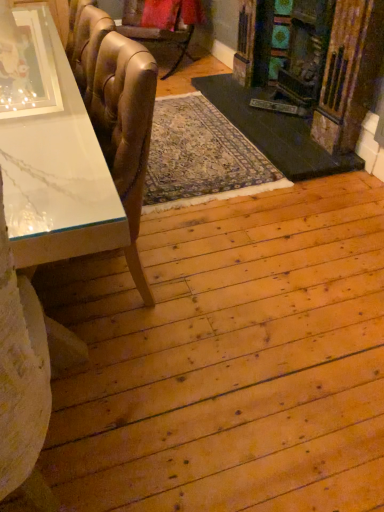
Question: Is leather-like gold chair at upper left, acting as the second chair starting from the front, smaller than white marble table at left?

Choices:
 (A) yes
 (B) no

Answer: (A)

Question: Is leather-like gold chair at upper left, which ranks as the second chair in bottom-to-top order, facing towards white marble table at left?

Choices:
 (A) yes
 (B) no

Answer: (A)

Question: Is white marble table at left a part of leather-like gold chair at upper left, marked as the first chair in a top-to-bottom arrangement?

Choices:
 (A) no
 (B) yes

Answer: (A)

Question: Would you say leather-like gold chair at upper left, which ranks as the second chair in bottom-to-top order, is outside white marble table at left?

Choices:
 (A) no
 (B) yes

Answer: (B)

Question: Is leather-like gold chair at upper left, which ranks as the second chair in bottom-to-top order, not near white marble table at left?

Choices:
 (A) no
 (B) yes

Answer: (B)

Question: Based on their sizes in the image, would you say leather-like gold chair at upper left, acting as the second chair starting from the front, is bigger or smaller than leather at left, positioned as the second chair in top-to-bottom order?

Choices:
 (A) big
 (B) small

Answer: (A)

Question: Is point (182, 49) positioned closer to the camera than point (124, 253)?

Choices:
 (A) closer
 (B) farther

Answer: (B)

Question: Is leather-like gold chair at upper left, acting as the second chair starting from the front, wider or thinner than leather at left, positioned as the 1th chair in front-to-back order?

Choices:
 (A) thin
 (B) wide

Answer: (B)

Question: From the image's perspective, is leather-like gold chair at upper left, marked as the first chair in a top-to-bottom arrangement, located above or below leather at left, the second chair in the back-to-front sequence?

Choices:
 (A) above
 (B) below

Answer: (A)

Question: Is white marble table at left taller or shorter than wooden fireplace at right?

Choices:
 (A) short
 (B) tall

Answer: (A)

Question: Considering the positions of point (8, 144) and point (362, 119), is point (8, 144) closer or farther from the camera than point (362, 119)?

Choices:
 (A) farther
 (B) closer

Answer: (B)

Question: Based on their positions, is white marble table at left located to the left or right of wooden fireplace at right?

Choices:
 (A) right
 (B) left

Answer: (B)

Question: Based on their sizes in the image, would you say white marble table at left is bigger or smaller than wooden fireplace at right?

Choices:
 (A) small
 (B) big

Answer: (B)

Question: Is leather at left, the first chair ordered from the bottom, inside the boundaries of leather-like gold chair at upper left, marked as the first chair in a top-to-bottom arrangement, or outside?

Choices:
 (A) outside
 (B) inside

Answer: (A)

Question: Visually, is leather at left, the second chair in the back-to-front sequence, positioned to the left or to the right of leather-like gold chair at upper left, acting as the second chair starting from the front?

Choices:
 (A) right
 (B) left

Answer: (A)